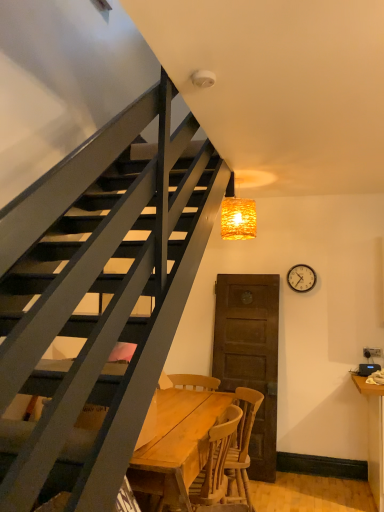
Find the location of `vacant point above woven golden light at upper center (from a real-world perspective)`. vacant point above woven golden light at upper center (from a real-world perspective) is located at coordinates (249, 178).